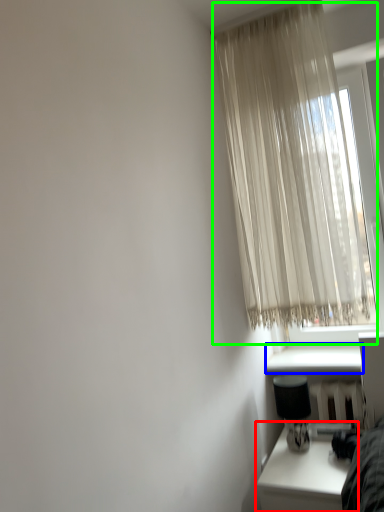
Question: Based on their relative distances, which object is farther from table (highlighted by a red box)? Choose from window sill (highlighted by a blue box) and curtain (highlighted by a green box).

Choices:
 (A) window sill
 (B) curtain

Answer: (B)